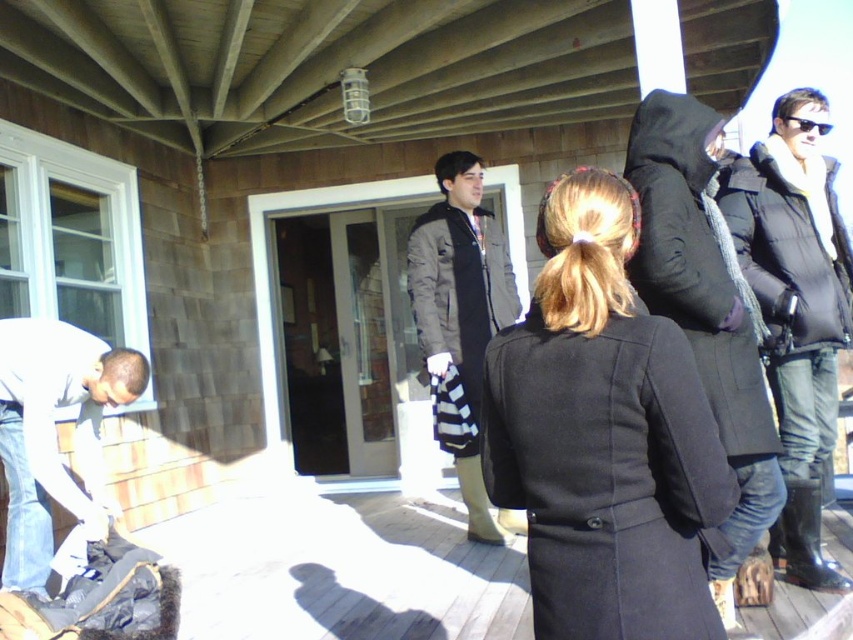
Question: Can you confirm if black wool coat at center is wider than dark gray fabric coat at center?

Choices:
 (A) yes
 (B) no

Answer: (B)

Question: Estimate the real-world distances between objects in this image. Which object is farther from the black fabric coat at center?

Choices:
 (A) dark gray fabric coat at center
 (B) black puffy jacket at right
 (C) black wool coat at center
 (D) white cotton shirt at lower left

Answer: (B)

Question: Can you confirm if black fabric coat at center is wider than white cotton shirt at lower left?

Choices:
 (A) yes
 (B) no

Answer: (A)

Question: Which object is farther from the camera taking this photo?

Choices:
 (A) dark gray fabric coat at center
 (B) black wool coat at center

Answer: (A)

Question: Which of these objects is positioned farthest from the white cotton shirt at lower left?

Choices:
 (A) dark gray fabric coat at center
 (B) black puffy jacket at right
 (C) black wool coat at center
 (D) black fabric coat at center

Answer: (B)

Question: Does black fabric coat at center have a lesser width compared to white cotton shirt at lower left?

Choices:
 (A) no
 (B) yes

Answer: (A)